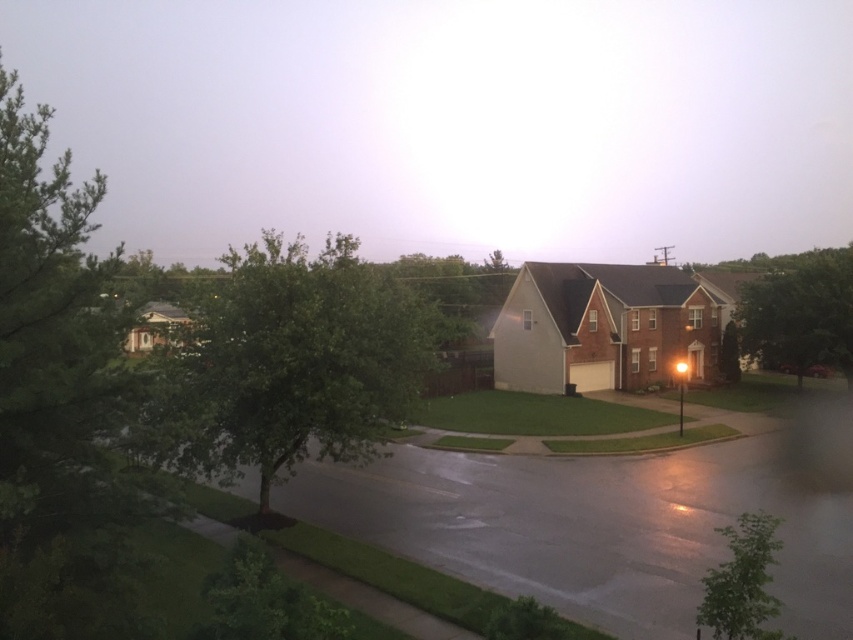
You are a delivery driver who needs to drive a truck that is 4 meters tall through the area. You see the green leafy tree at center and the green leafy tree at upper right. Which tree might pose a height risk to your truck?

The green leafy tree at center is taller than the green leafy tree at upper right, so the green leafy tree at center might pose a height risk to the truck.

Based on the scene description, which green leafy tree is wider between the green leafy tree at upper right and the green leafy tree at lower right?

The green leafy tree at upper right is wider than the green leafy tree at lower right.

You are a city planner evaluating the space between the green leafy tree at center and the green leafy tree at upper right. Based on their widths, which tree would cast a wider shadow during the evening?

The green leafy tree at center has a larger width than the green leafy tree at upper right, so it would cast a wider shadow during the evening.